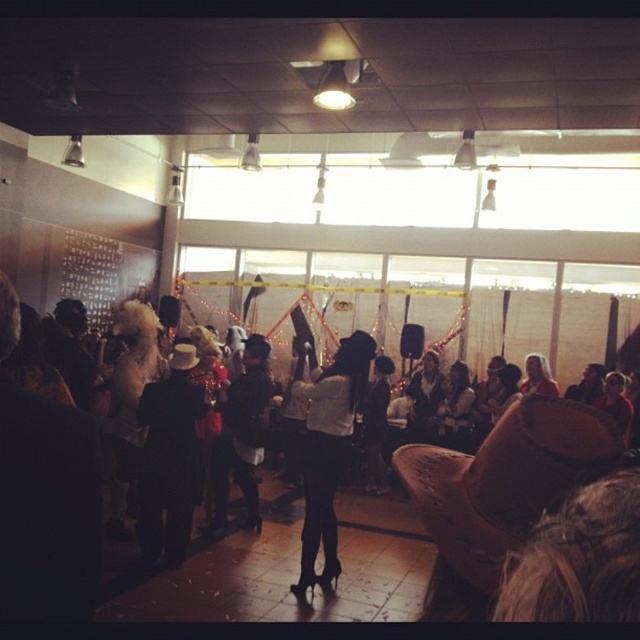
Does black matte suit at center have a greater height compared to black leather jacket at center?

In fact, black matte suit at center may be shorter than black leather jacket at center.

Can you confirm if black matte suit at center is positioned below black leather jacket at center?

No.

Is point (164, 410) positioned after point (225, 426)?

That is False.

The width and height of the screenshot is (640, 640). I want to click on black matte suit at center, so click(x=170, y=458).

Does point (337, 449) lie in front of point (250, 490)?

Yes, it is in front of point (250, 490).

Is point (348, 358) positioned after point (236, 436)?

No, it is in front of (236, 436).

Identify the location of white matte jacket at center. (326, 448).

Does black matte suit at center have a lesser height compared to white matte jacket at center?

Yes.

Who is shorter, black matte suit at center or white matte jacket at center?

Standing shorter between the two is black matte suit at center.

Between point (179, 412) and point (307, 467), which one is positioned in front?

Point (307, 467)

Where is `black matte suit at center`? The image size is (640, 640). black matte suit at center is located at coordinates pyautogui.click(x=170, y=458).